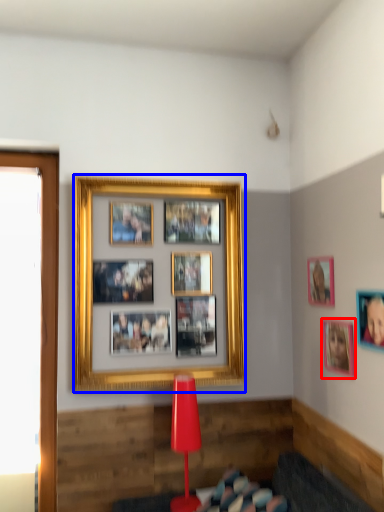
Question: Which point is further to the camera, picture frame (highlighted by a red box) or picture frame (highlighted by a blue box)?

Choices:
 (A) picture frame
 (B) picture frame

Answer: (B)